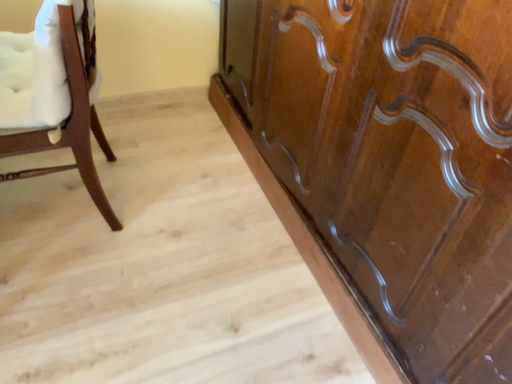
Locate an element on the screen. The image size is (512, 384). brown wood chair at left is located at coordinates (56, 96).

What do you see at coordinates (56, 96) in the screenshot? I see `brown wood chair at left` at bounding box center [56, 96].

Locate an element on the screen. brown wood chair at left is located at coordinates (56, 96).